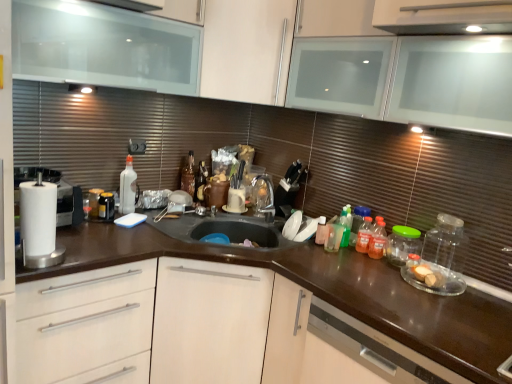
Find the location of a particular element. free space in front of translucent plastic bottle at center is located at coordinates (336, 264).